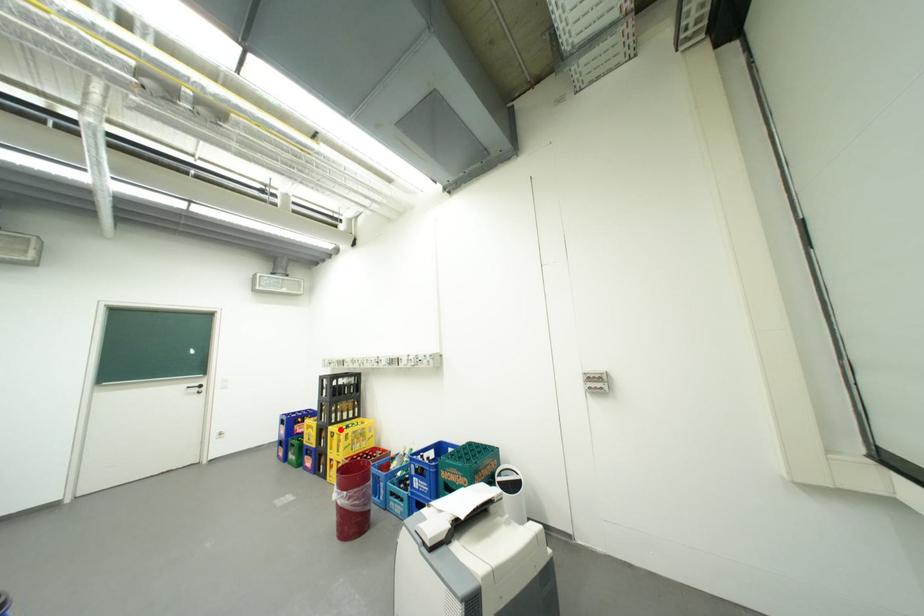
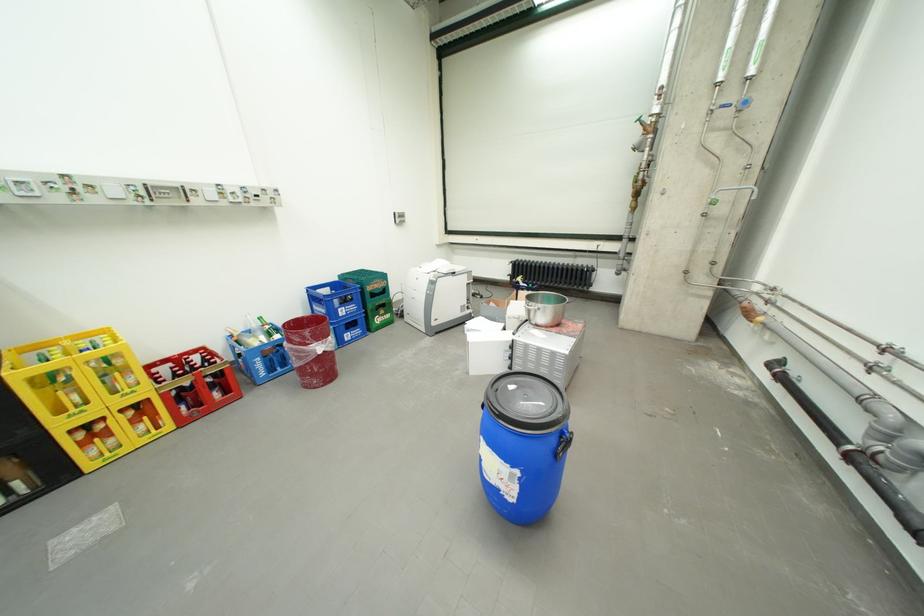
Locate, in the second image, the point that corresponds to the highlighted location in the first image.

(30, 374)